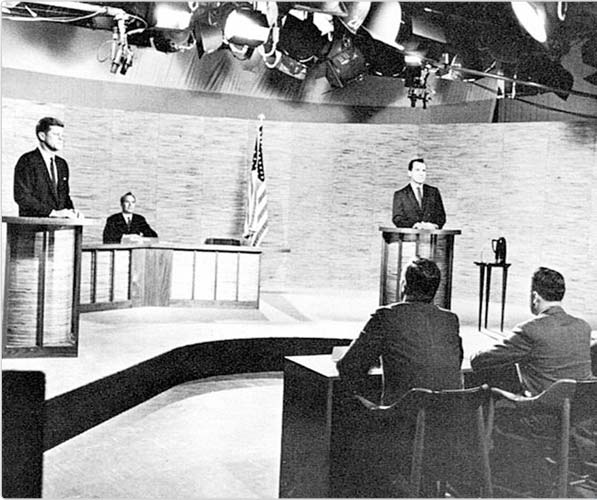
You are a GUI agent. You are given a task and a screenshot of the screen. Output one action in this format:
    pyautogui.click(x=<x>, y=<y>)
    Task: Click on the stage
    This screenshot has height=500, width=597.
    Given the screenshot: What is the action you would take?
    pyautogui.click(x=202, y=353), pyautogui.click(x=150, y=326), pyautogui.click(x=478, y=330), pyautogui.click(x=587, y=317), pyautogui.click(x=593, y=351), pyautogui.click(x=463, y=299)